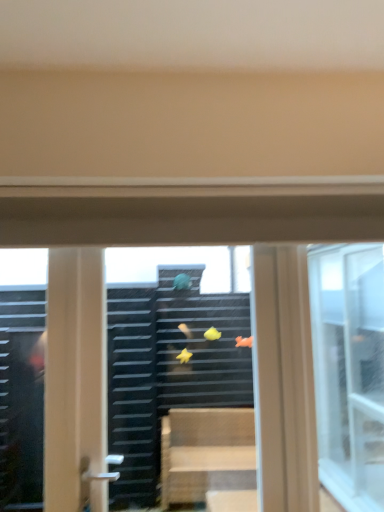
Question: Is transparent glass window at center, acting as the first window starting from the right, taller or shorter than transparent plastic magnets at center?

Choices:
 (A) tall
 (B) short

Answer: (B)

Question: From the image's perspective, is transparent glass window at center, which ranks as the 2th window in left-to-right order, located above or below transparent plastic magnets at center?

Choices:
 (A) below
 (B) above

Answer: (A)

Question: Which is nearer to the transparent glass window at center, the 2th window from the right?

Choices:
 (A) transparent glass window at center, acting as the first window starting from the right
 (B) transparent plastic magnets at center

Answer: (B)

Question: Estimate the real-world distances between objects in this image. Which object is farther from the transparent plastic magnets at center?

Choices:
 (A) transparent glass window at center, which ranks as the 2th window in left-to-right order
 (B) transparent glass window at center, the 2th window from the right

Answer: (A)